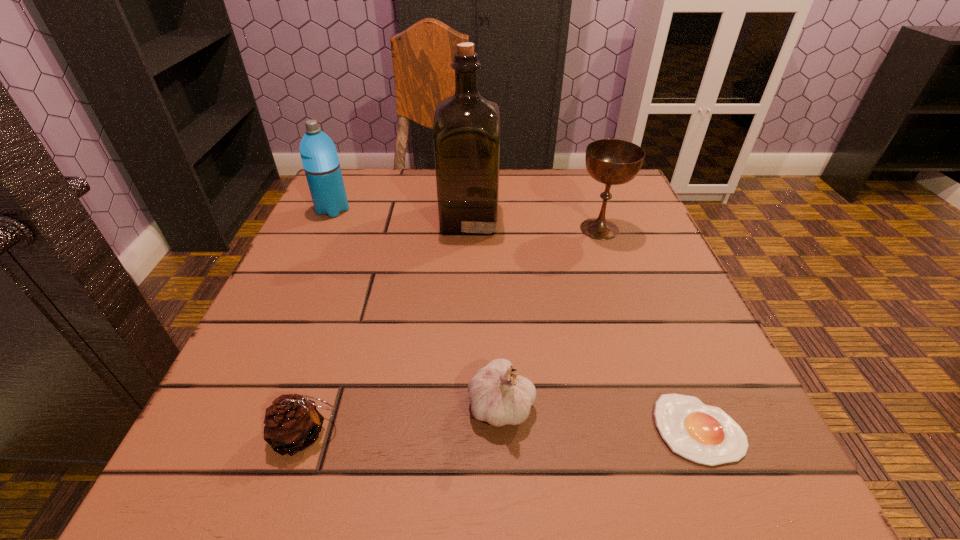
Where is `vacant space that satisfies the following two spatial constraints: 1. on the front side of the shortest object; 2. on the left side of the third shortest object`? The height and width of the screenshot is (540, 960). vacant space that satisfies the following two spatial constraints: 1. on the front side of the shortest object; 2. on the left side of the third shortest object is located at coordinates (502, 429).

Find the location of a particular element. blank area in the image that satisfies the following two spatial constraints: 1. on the label of the shortest object; 2. on the right side of the liquor is located at coordinates (462, 429).